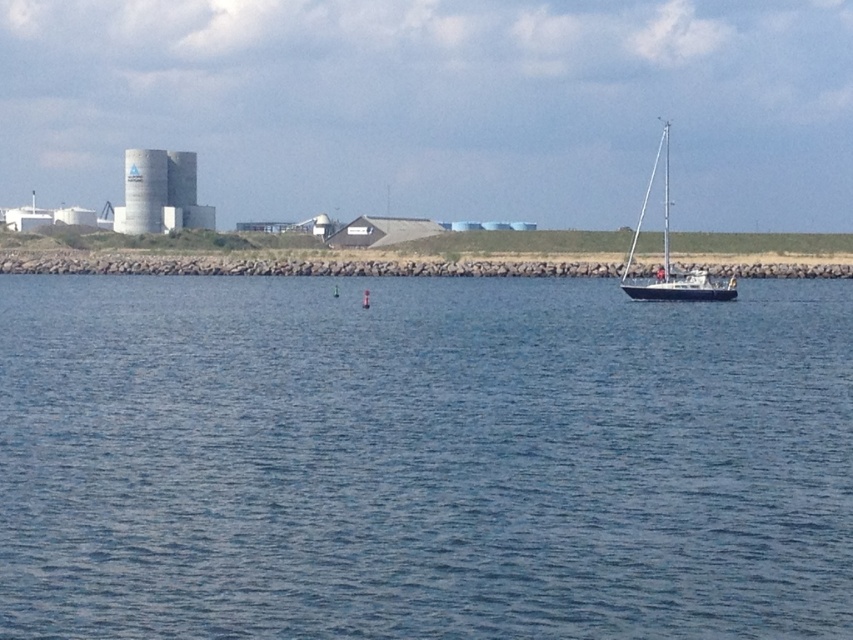
Between white concrete silo at left and white matte sailboat at right, which one is positioned lower?

white matte sailboat at right

Between white concrete silo at left and white matte sailboat at right, which one has less height?

white concrete silo at left

Is point (137, 188) positioned behind point (625, 275)?

Yes, point (137, 188) is farther from viewer.

Locate an element on the screen. This screenshot has width=853, height=640. white concrete silo at left is located at coordinates (161, 193).

Is blue water at center below rocky shore at lower center?

→ Yes, blue water at center is below rocky shore at lower center.

How much distance is there between blue water at center and rocky shore at lower center?

They are 132.11 feet apart.

In order to click on blue water at center in this screenshot , I will do `click(422, 460)`.

Is rocky shore at lower center shorter than white matte sailboat at right?

Yes.

Between rocky shore at lower center and white matte sailboat at right, which one has more height?

With more height is white matte sailboat at right.

Identify the location of rocky shore at lower center. The height and width of the screenshot is (640, 853). [286, 266].

What are the coordinates of `rocky shore at lower center` in the screenshot? It's located at (286, 266).